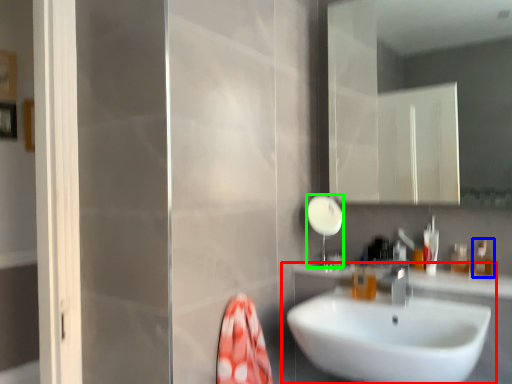
Question: Which object is the farthest from sink (highlighted by a red box)? Choose among these: toiletry (highlighted by a blue box) or shower (highlighted by a green box).

Choices:
 (A) toiletry
 (B) shower

Answer: (A)